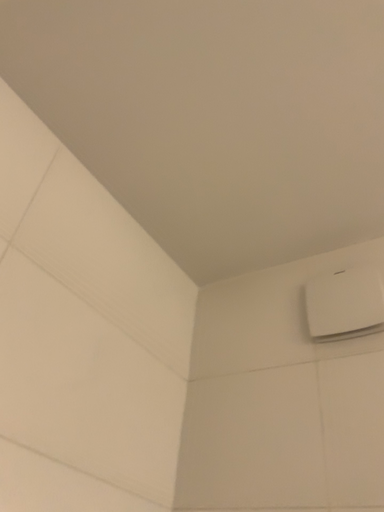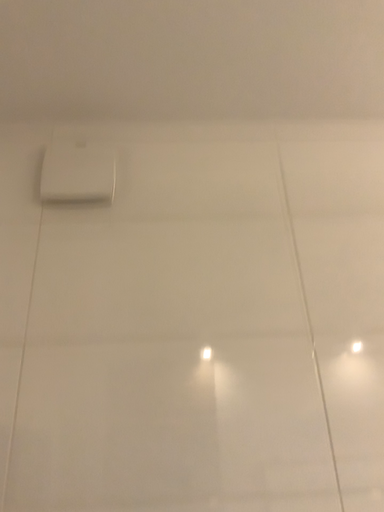
Question: Which way did the camera rotate in the video?

Choices:
 (A) rotated upward
 (B) rotated downward

Answer: (B)